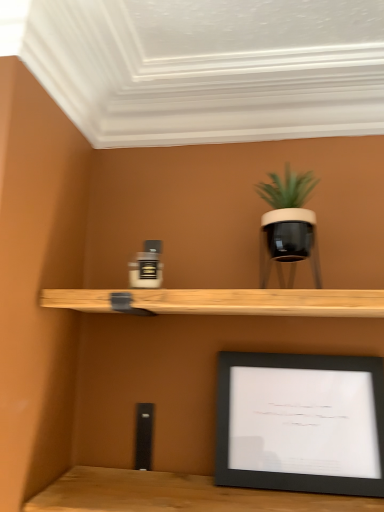
Question: Is black matte picture frame at lower right in front of or behind matte black pot at upper right in the image?

Choices:
 (A) front
 (B) behind

Answer: (B)

Question: Would you say black matte picture frame at lower right is inside or outside matte black pot at upper right?

Choices:
 (A) outside
 (B) inside

Answer: (A)

Question: In terms of width, does black matte picture frame at lower right look wider or thinner when compared to matte black pot at upper right?

Choices:
 (A) wide
 (B) thin

Answer: (B)

Question: From a real-world perspective, relative to black matte picture frame at lower right, is matte black pot at upper right vertically above or below?

Choices:
 (A) below
 (B) above

Answer: (B)

Question: Looking at their shapes, would you say matte black pot at upper right is wider or thinner than black matte picture frame at lower right?

Choices:
 (A) wide
 (B) thin

Answer: (A)

Question: In terms of size, does matte black pot at upper right appear bigger or smaller than black matte picture frame at lower right?

Choices:
 (A) big
 (B) small

Answer: (B)

Question: Is matte black pot at upper right spatially inside black matte picture frame at lower right, or outside of it?

Choices:
 (A) inside
 (B) outside

Answer: (B)